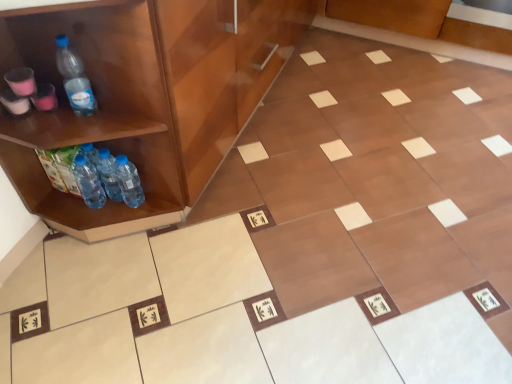
Measure the distance between point (83, 77) and camera.

The distance of point (83, 77) from camera is 1.12 meters.

Locate an element on the screen. The image size is (512, 384). transparent plastic bottle at left, acting as the second bottle starting from the left is located at coordinates (74, 78).

At what (x,y) coordinates should I click in order to perform the action: click on translucent plastic bottles at left, the second bottle positioned from the right. Please return your answer as a coordinate pair (x, y). This screenshot has width=512, height=384. Looking at the image, I should click on (108, 174).

This screenshot has width=512, height=384. What do you see at coordinates (129, 182) in the screenshot?
I see `translucent plastic bottles at lower left, the first bottle viewed from the right` at bounding box center [129, 182].

Where is `transparent plastic bottle at left, acting as the second bottle starting from the left`? The height and width of the screenshot is (384, 512). transparent plastic bottle at left, acting as the second bottle starting from the left is located at coordinates (74, 78).

Are translucent plastic bottles at lower left, the first bottle viewed from the right, and translucent plastic bottles at left, the second bottle positioned from the right, located far from each other?

No, translucent plastic bottles at lower left, the first bottle viewed from the right, is not far away from translucent plastic bottles at left, the second bottle positioned from the right.

Which is in front, point (132, 193) or point (109, 178)?

Positioned in front is point (109, 178).

Does translucent plastic bottles at lower left, placed as the fourth bottle when sorted from left to right, appear on the left side of translucent plastic bottles at left, acting as the third bottle starting from the left?

In fact, translucent plastic bottles at lower left, placed as the fourth bottle when sorted from left to right, is to the right of translucent plastic bottles at left, acting as the third bottle starting from the left.

Is transparent plastic bottle at left, the 3th bottle positioned from the right, completely or partially inside blue plastic bottle at lower left, the fourth bottle viewed from the right?

Actually, transparent plastic bottle at left, the 3th bottle positioned from the right, is outside blue plastic bottle at lower left, the fourth bottle viewed from the right.

In the scene shown: From the image's perspective, who appears lower, blue plastic bottle at lower left, the fourth bottle viewed from the right, or transparent plastic bottle at left, acting as the second bottle starting from the left?

blue plastic bottle at lower left, the fourth bottle viewed from the right, is shown below in the image.

How far apart are blue plastic bottle at lower left, which is the 1th bottle in left-to-right order, and transparent plastic bottle at left, acting as the second bottle starting from the left?

blue plastic bottle at lower left, which is the 1th bottle in left-to-right order, is 11.68 inches from transparent plastic bottle at left, acting as the second bottle starting from the left.

From their relative heights in the image, would you say blue plastic bottle at lower left, which is the 1th bottle in left-to-right order, is taller or shorter than transparent plastic bottle at left, the 3th bottle positioned from the right?

In the image, blue plastic bottle at lower left, which is the 1th bottle in left-to-right order, appears to be shorter than transparent plastic bottle at left, the 3th bottle positioned from the right.

Considering the relative sizes of brown glossy cabinet at left and transparent plastic bottle at left, acting as the second bottle starting from the left, in the image provided, is brown glossy cabinet at left wider than transparent plastic bottle at left, acting as the second bottle starting from the left,?

Yes, brown glossy cabinet at left is wider than transparent plastic bottle at left, acting as the second bottle starting from the left.

Which of these two, brown glossy cabinet at left or transparent plastic bottle at left, acting as the second bottle starting from the left, stands taller?

brown glossy cabinet at left is taller.

From a real-world perspective, relative to transparent plastic bottle at left, the 3th bottle positioned from the right, is brown glossy cabinet at left vertically above or below?

brown glossy cabinet at left is below transparent plastic bottle at left, the 3th bottle positioned from the right.

Considering the sizes of objects brown glossy cabinet at left and transparent plastic bottle at left, the 3th bottle positioned from the right, in the image provided, who is bigger, brown glossy cabinet at left or transparent plastic bottle at left, the 3th bottle positioned from the right,?

brown glossy cabinet at left.

Looking at this image, from the image's perspective, does brown glossy cabinet at left appear lower than translucent plastic bottles at left, the second bottle positioned from the right?

No, from the image's perspective, brown glossy cabinet at left is not beneath translucent plastic bottles at left, the second bottle positioned from the right.

Can you confirm if brown glossy cabinet at left is smaller than translucent plastic bottles at left, the second bottle positioned from the right?

Actually, brown glossy cabinet at left might be larger than translucent plastic bottles at left, the second bottle positioned from the right.

Find the location of a particular element. This screenshot has height=384, width=512. cabinetry in front of the translucent plastic bottles at left, acting as the third bottle starting from the left is located at coordinates (145, 96).

Measure the distance from brown glossy cabinet at left to blue plastic bottle at lower left, the fourth bottle viewed from the right.

They are 13.64 inches apart.

Looking at this image, is brown glossy cabinet at left thinner than blue plastic bottle at lower left, the fourth bottle viewed from the right?

No.

From their relative heights in the image, would you say brown glossy cabinet at left is taller or shorter than blue plastic bottle at lower left, the fourth bottle viewed from the right?

In the image, brown glossy cabinet at left appears to be taller than blue plastic bottle at lower left, the fourth bottle viewed from the right.

Considering the positions of objects brown glossy cabinet at left and blue plastic bottle at lower left, which is the 1th bottle in left-to-right order, in the image provided, who is behind, brown glossy cabinet at left or blue plastic bottle at lower left, which is the 1th bottle in left-to-right order,?

blue plastic bottle at lower left, which is the 1th bottle in left-to-right order.

Would you say transparent plastic bottle at left, acting as the second bottle starting from the left, contains brown glossy cabinet at left?

No.

Is transparent plastic bottle at left, the 3th bottle positioned from the right, turned away from brown glossy cabinet at left?

Yes.

Is point (78, 92) positioned after point (286, 14)?

No, (78, 92) is in front of (286, 14).

Is transparent plastic bottle at left, the 3th bottle positioned from the right, in front of or behind brown glossy cabinet at left in the image?

transparent plastic bottle at left, the 3th bottle positioned from the right, is behind brown glossy cabinet at left.

Consider the image. Is translucent plastic bottles at lower left, placed as the fourth bottle when sorted from left to right, wider than brown glossy cabinet at left?

No.

Would you say translucent plastic bottles at lower left, placed as the fourth bottle when sorted from left to right, is inside or outside brown glossy cabinet at left?

translucent plastic bottles at lower left, placed as the fourth bottle when sorted from left to right, is inside brown glossy cabinet at left.

Is translucent plastic bottles at lower left, placed as the fourth bottle when sorted from left to right, next to brown glossy cabinet at left and touching it?

No, translucent plastic bottles at lower left, placed as the fourth bottle when sorted from left to right, is not in contact with brown glossy cabinet at left.

The width and height of the screenshot is (512, 384). What are the coordinates of `bottle on the right of translucent plastic bottles at left, acting as the third bottle starting from the left` in the screenshot? It's located at (129, 182).

Locate an element on the screen. bottle on the left of transparent plastic bottle at left, acting as the second bottle starting from the left is located at coordinates click(x=88, y=182).

Which object lies further to the anchor point transparent plastic bottle at left, acting as the second bottle starting from the left, translucent plastic bottles at left, the second bottle positioned from the right, or translucent plastic bottles at lower left, placed as the fourth bottle when sorted from left to right?

translucent plastic bottles at left, the second bottle positioned from the right, is further to transparent plastic bottle at left, acting as the second bottle starting from the left.

When comparing their distances from translucent plastic bottles at lower left, the first bottle viewed from the right, does brown glossy cabinet at left or blue plastic bottle at lower left, the fourth bottle viewed from the right, seem closer?

Among the two, blue plastic bottle at lower left, the fourth bottle viewed from the right, is located nearer to translucent plastic bottles at lower left, the first bottle viewed from the right.

Based on their spatial positions, is translucent plastic bottles at lower left, the first bottle viewed from the right, or blue plastic bottle at lower left, which is the 1th bottle in left-to-right order, closer to brown glossy cabinet at left?

translucent plastic bottles at lower left, the first bottle viewed from the right.

Which object lies further to the anchor point translucent plastic bottles at left, the second bottle positioned from the right, brown glossy cabinet at left or translucent plastic bottles at lower left, the first bottle viewed from the right?

brown glossy cabinet at left is positioned further to the anchor translucent plastic bottles at left, the second bottle positioned from the right.

Considering their positions, is translucent plastic bottles at lower left, placed as the fourth bottle when sorted from left to right, positioned further to translucent plastic bottles at left, acting as the third bottle starting from the left, than blue plastic bottle at lower left, which is the 1th bottle in left-to-right order?

translucent plastic bottles at lower left, placed as the fourth bottle when sorted from left to right, lies further to translucent plastic bottles at left, acting as the third bottle starting from the left, than the other object.

Looking at this image, based on their spatial positions, is transparent plastic bottle at left, acting as the second bottle starting from the left, or translucent plastic bottles at left, acting as the third bottle starting from the left, further from brown glossy cabinet at left?

translucent plastic bottles at left, acting as the third bottle starting from the left.

When comparing their distances from translucent plastic bottles at left, acting as the third bottle starting from the left, does transparent plastic bottle at left, the 3th bottle positioned from the right, or blue plastic bottle at lower left, the fourth bottle viewed from the right, seem further?

transparent plastic bottle at left, the 3th bottle positioned from the right, is further to translucent plastic bottles at left, acting as the third bottle starting from the left.

Which object lies nearer to the anchor point brown glossy cabinet at left, translucent plastic bottles at left, the second bottle positioned from the right, or transparent plastic bottle at left, the 3th bottle positioned from the right?

transparent plastic bottle at left, the 3th bottle positioned from the right.

At what (x,y) coordinates should I click in order to perform the action: click on bottle that lies between brown glossy cabinet at left and translucent plastic bottles at left, the second bottle positioned from the right, from top to bottom. Please return your answer as a coordinate pair (x, y). The width and height of the screenshot is (512, 384). Looking at the image, I should click on (74, 78).